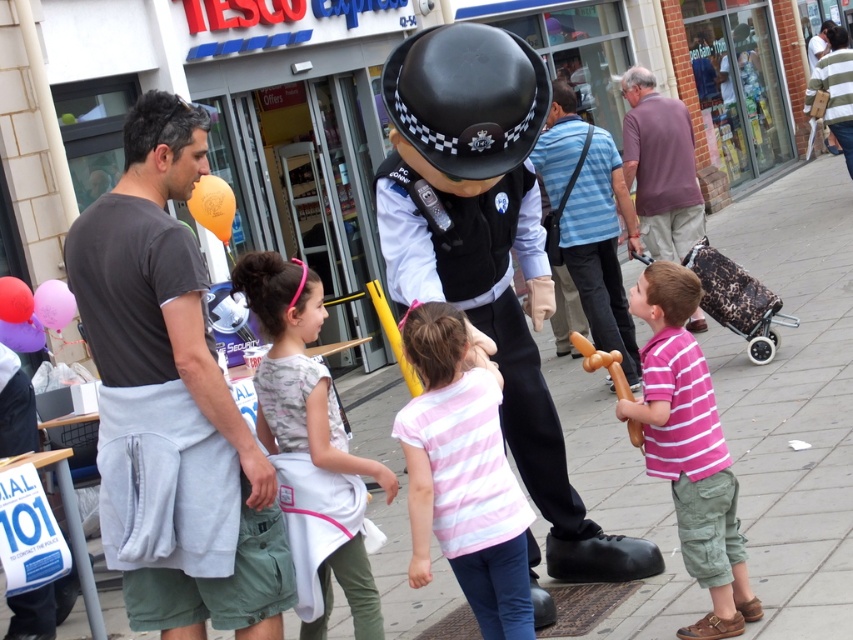
You are a photographer standing near the Tesco Express store. You want to take a photo that includes both the shiny black helmet at center and the pink striped shirt at lower right. Based on their positions, which object should appear higher in the photo?

The shiny black helmet at center appears higher in the photo because it is positioned above the pink striped shirt at lower right.

You are a photographer trying to capture a candid shot of the pink striped shirt at center and the pink fabric dress at center in the same frame. Given that your camera has a minimum focus distance of 18 inches, will you be able to capture both subjects clearly in the frame?

The distance between the pink striped shirt at center and the pink fabric dress at center is 19.05 inches, which is just over the camera minimum focus distance of 18 inches. Therefore, you can capture both subjects clearly in the frame.

You are a photographer standing at the entrance of the Tesco Express store. You need to capture a photo that includes both the shiny black helmet at center and the pink striped shirt at lower right. Based on their heights, which object should be placed closer to the camera to ensure both are fully visible in the frame?

The shiny black helmet at center is taller than the pink striped shirt at lower right. To ensure both are fully visible, the pink striped shirt at lower right should be placed closer to the camera so that the taller helmet doesn not block it.